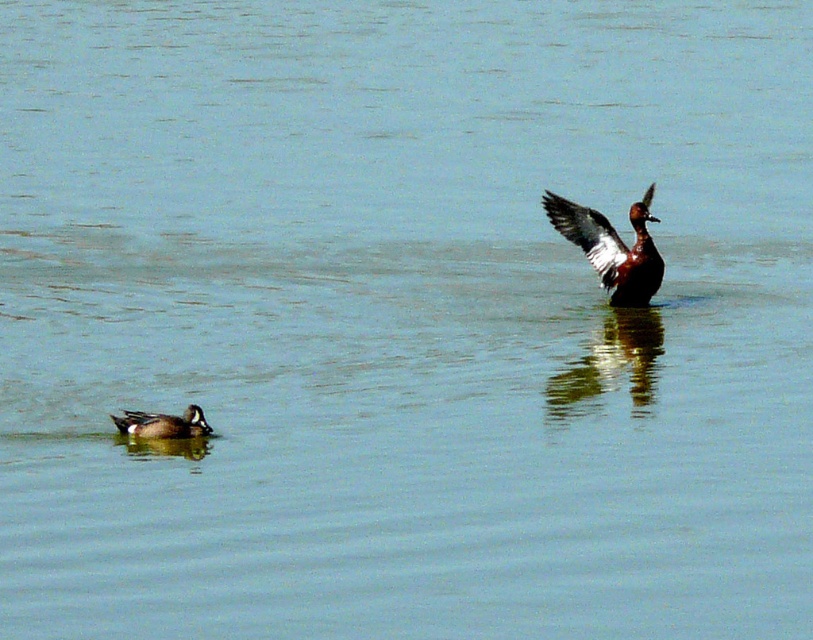
Can you confirm if shiny brown wing at upper right is smaller than greenish-gray feathers duck at lower left?

Incorrect, shiny brown wing at upper right is not smaller in size than greenish-gray feathers duck at lower left.

Where is `shiny brown wing at upper right`? This screenshot has height=640, width=813. shiny brown wing at upper right is located at coordinates (588, 236).

Is brown glossy duck at upper right to the right of greenish-gray feathers duck at lower left from the viewer's perspective?

Indeed, brown glossy duck at upper right is positioned on the right side of greenish-gray feathers duck at lower left.

This screenshot has width=813, height=640. Find the location of `brown glossy duck at upper right`. brown glossy duck at upper right is located at coordinates (612, 248).

Measure the distance between brown glossy duck at upper right and camera.

brown glossy duck at upper right is 12.54 meters away from camera.

Locate an element on the screen. brown glossy duck at upper right is located at coordinates (612, 248).